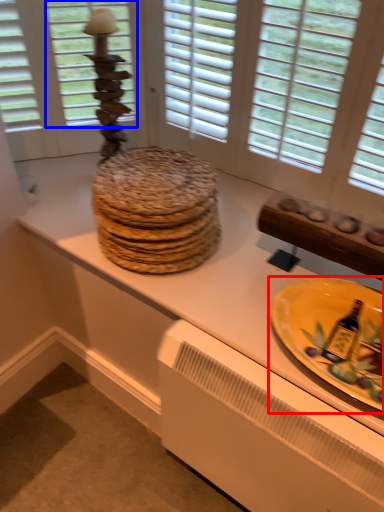
Question: Which object is closer to the camera taking this photo, plate (highlighted by a red box) or window screen (highlighted by a blue box)?

Choices:
 (A) plate
 (B) window screen

Answer: (A)